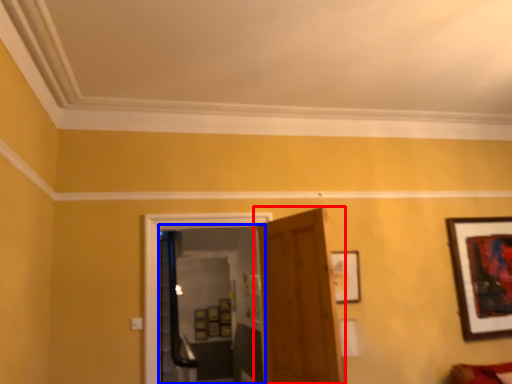
Question: Which object is closer to the camera taking this photo, door (highlighted by a red box) or glass door (highlighted by a blue box)?

Choices:
 (A) door
 (B) glass door

Answer: (A)